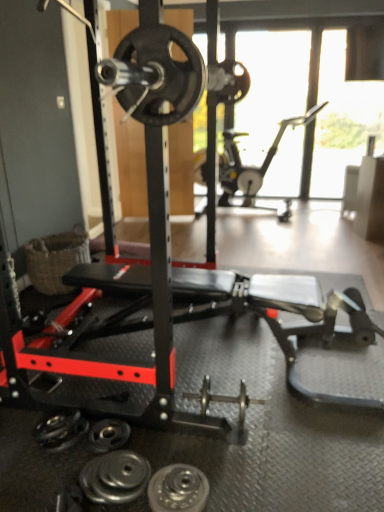
Question: Is black rubber weight plate at lower center, the 1th wheel viewed from the back, positioned behind metallic silver exercise bike at upper right?

Choices:
 (A) no
 (B) yes

Answer: (A)

Question: From the image's perspective, is black rubber weight plate at lower center, the 1th wheel from the left, located above metallic silver exercise bike at upper right?

Choices:
 (A) no
 (B) yes

Answer: (A)

Question: Is black rubber weight plate at lower center, the second wheel when ordered from right to left, closer to the viewer compared to metallic silver exercise bike at upper right?

Choices:
 (A) yes
 (B) no

Answer: (A)

Question: Is metallic silver exercise bike at upper right at the back of black rubber weight plate at lower center, the 1th wheel viewed from the back?

Choices:
 (A) yes
 (B) no

Answer: (B)

Question: Is black rubber weight plate at lower center, the 1th wheel from the left, at the left side of metallic silver exercise bike at upper right?

Choices:
 (A) yes
 (B) no

Answer: (A)

Question: Is silver metallic weight plate at lower center, which appears as the first wheel when viewed from the front, wider or thinner than polished silver dumbbell at lower left, arranged as the 2th dumbbell when viewed from the top?

Choices:
 (A) wide
 (B) thin

Answer: (A)

Question: Does point (165, 501) appear closer or farther from the camera than point (140, 466)?

Choices:
 (A) farther
 (B) closer

Answer: (B)

Question: Is silver metallic weight plate at lower center, which appears as the first wheel when viewed from the front, to the left or to the right of polished silver dumbbell at lower left, the 2th dumbbell from the back, in the image?

Choices:
 (A) right
 (B) left

Answer: (A)

Question: In terms of size, does silver metallic weight plate at lower center, which appears as the first wheel when viewed from the front, appear bigger or smaller than polished silver dumbbell at lower left, the 2th dumbbell from the back?

Choices:
 (A) big
 (B) small

Answer: (B)

Question: Is woven brown basket at lower left taller or shorter than black rubberized training bench at center?

Choices:
 (A) tall
 (B) short

Answer: (A)

Question: Considering the positions of woven brown basket at lower left and black rubberized training bench at center in the image, is woven brown basket at lower left wider or thinner than black rubberized training bench at center?

Choices:
 (A) wide
 (B) thin

Answer: (B)

Question: Would you say woven brown basket at lower left is to the left or to the right of black rubberized training bench at center in the picture?

Choices:
 (A) right
 (B) left

Answer: (B)

Question: Choose the correct answer: Is woven brown basket at lower left inside black rubberized training bench at center or outside it?

Choices:
 (A) outside
 (B) inside

Answer: (A)

Question: Considering the positions of black rubber weight plate at lower center, the second wheel when ordered from right to left, and black rubberized training bench at center in the image, is black rubber weight plate at lower center, the second wheel when ordered from right to left, taller or shorter than black rubberized training bench at center?

Choices:
 (A) tall
 (B) short

Answer: (B)

Question: Choose the correct answer: Is black rubber weight plate at lower center, the 2th wheel when ordered from front to back, inside black rubberized training bench at center or outside it?

Choices:
 (A) outside
 (B) inside

Answer: (B)